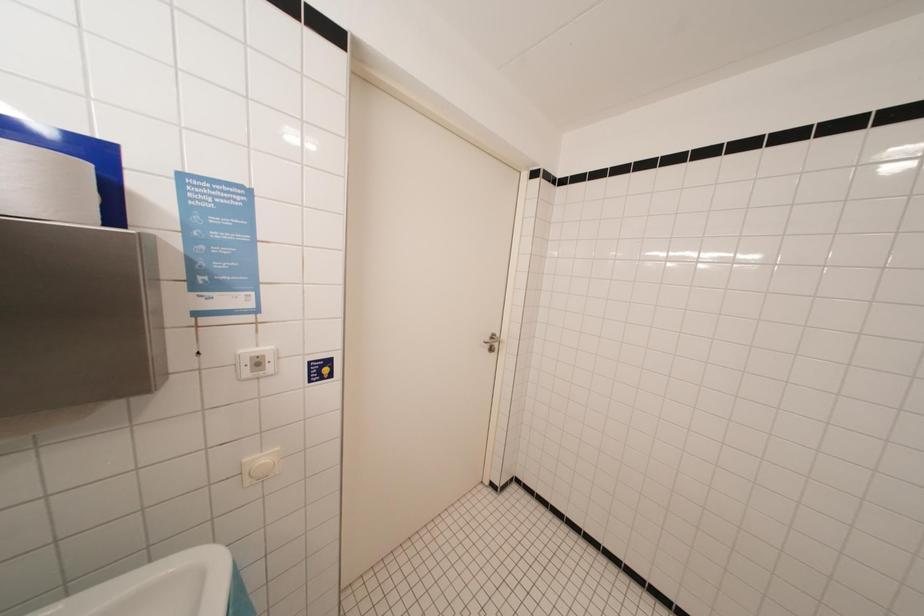
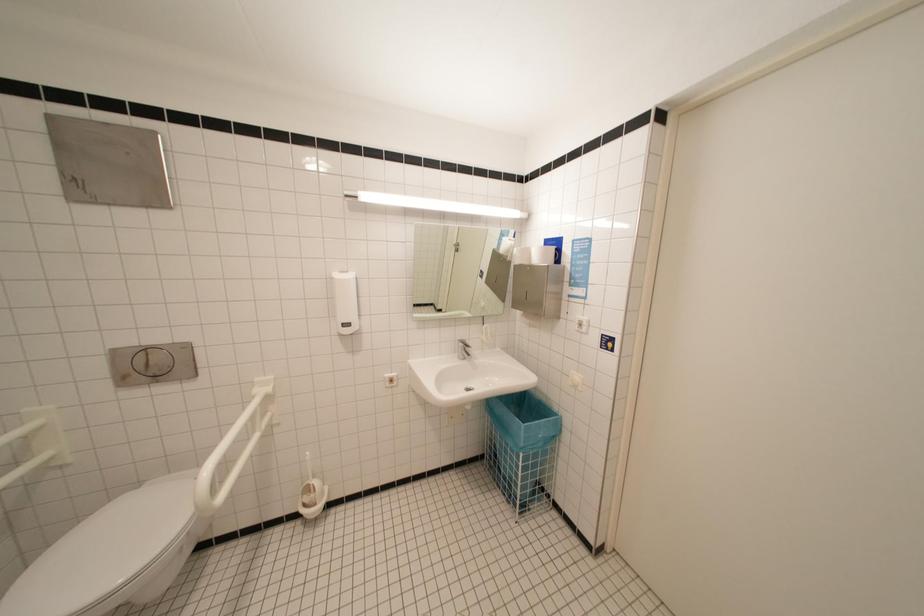
Question: The images are taken continuously from a first-person perspective. In which direction is your viewpoint rotating?

Choices:
 (A) Left
 (B) Right
 (C) Up
 (D) Down

Answer: (A)